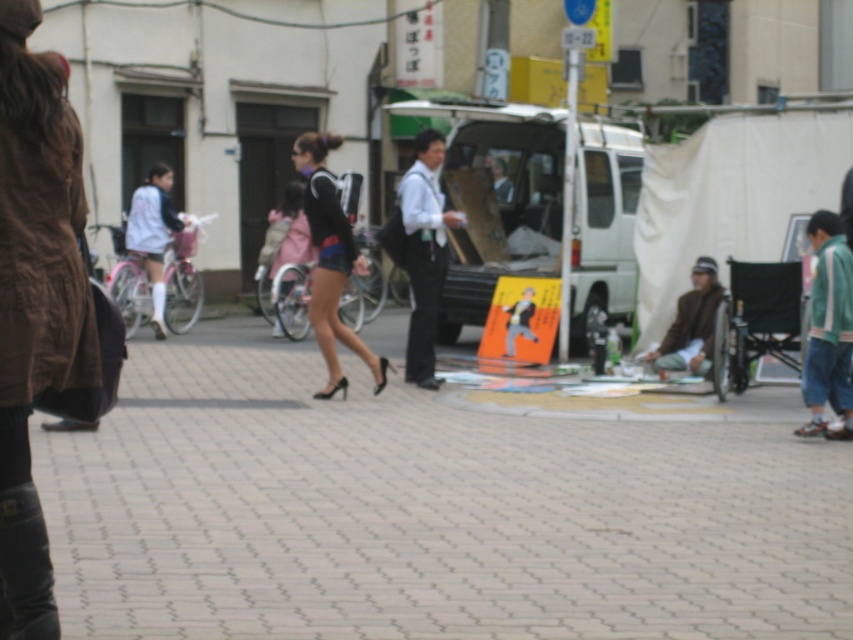
You are a photographer trying to capture the entire paved stone sidewalk at center and the matte black shorts at center in a single frame. Given that your camera can only focus on objects within a 100cm width, will both objects fit in the frame?

The paved stone sidewalk at center is bigger than matte black shorts at center, but without specific measurements of their actual widths, it is impossible to determine if both will fit within the 100cm frame. The description only states a size comparison between the two objects, not their absolute sizes.